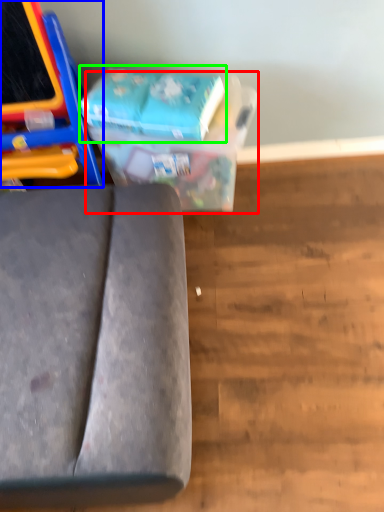
Question: Which is nearer to the cardboard box (highlighted by a red box)? furniture (highlighted by a blue box) or paperback book (highlighted by a green box).

Choices:
 (A) furniture
 (B) paperback book

Answer: (B)